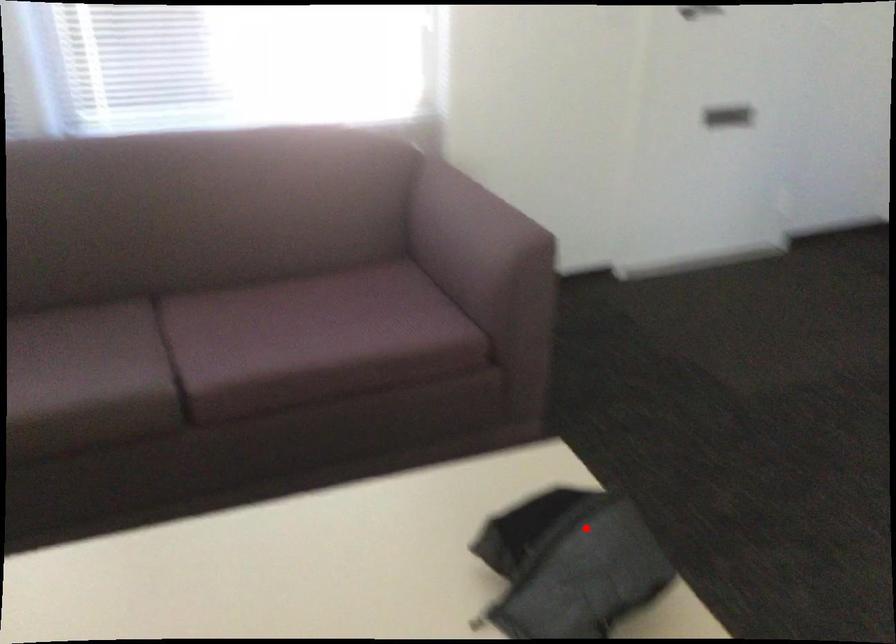
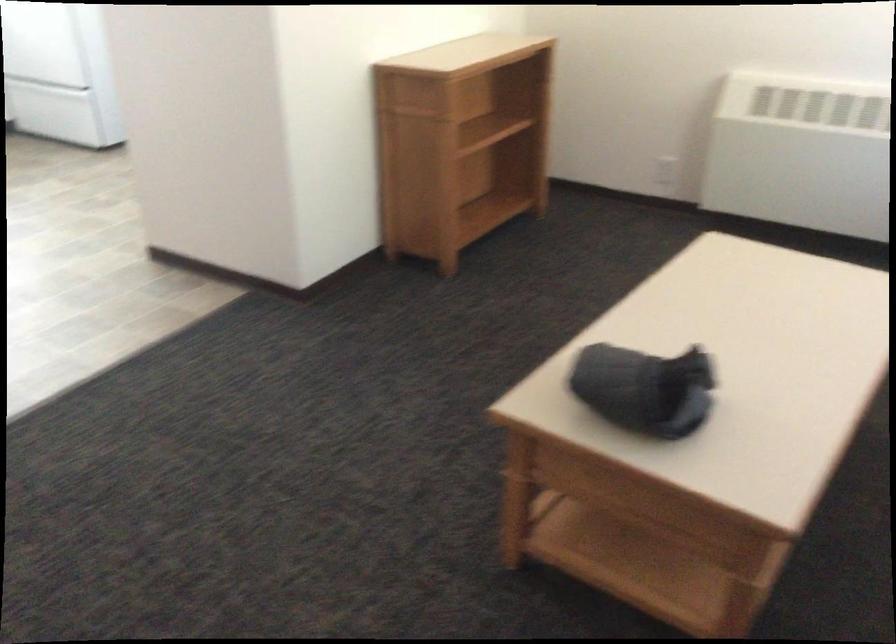
Question: I am providing you with two images of the same scene from different viewpoints. In image1, a red point is highlighted. Considering the same 3D point in image2, which of the following is correct?

Choices:
 (A) It is closer
 (B) It is farther

Answer: (B)